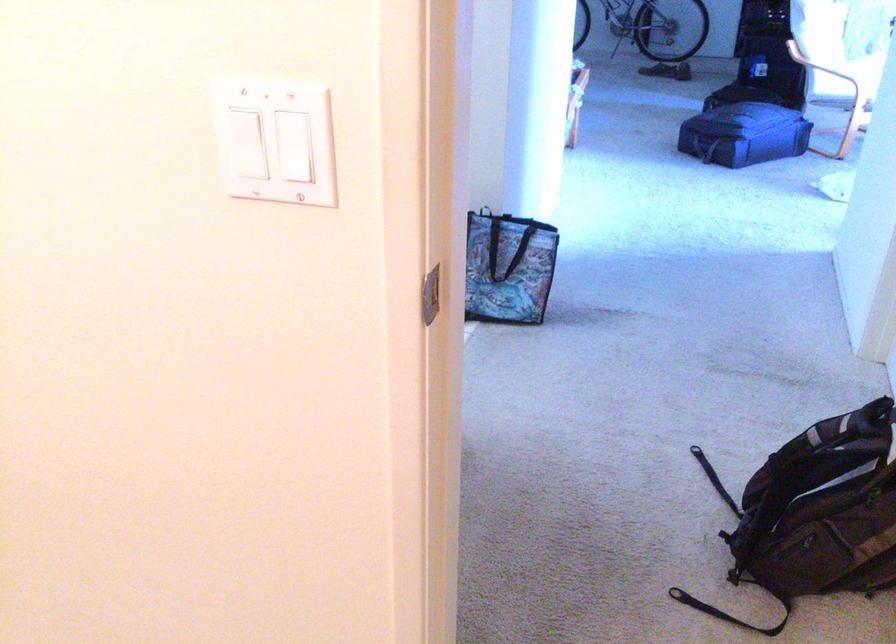
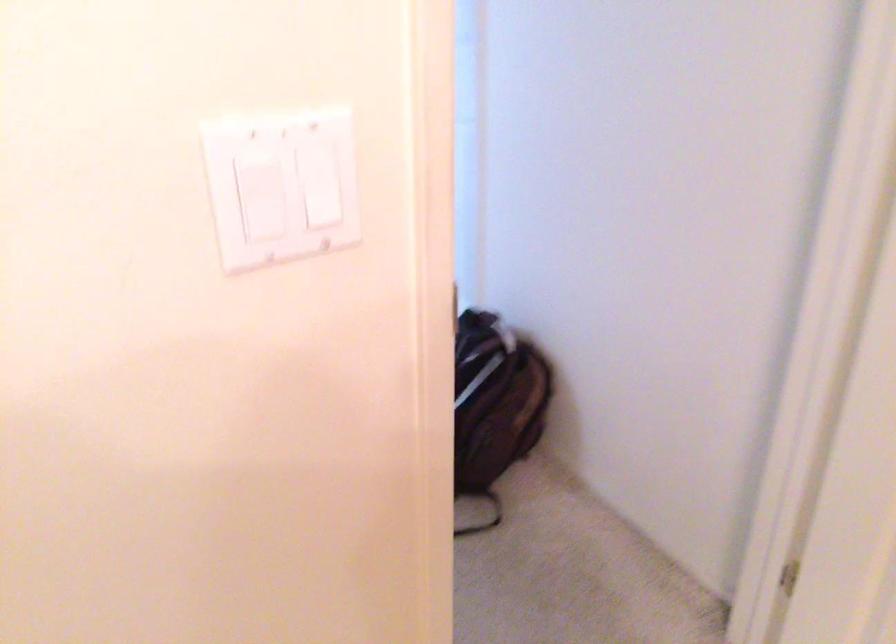
Question: I am providing you with two images of the same scene from different viewpoints. After the viewpoint changes to image2, which objects are now occluded?

Choices:
 (A) brown backpack
 (B) black bag handle
 (C) white light switch
 (D) green pen holder

Answer: (B)